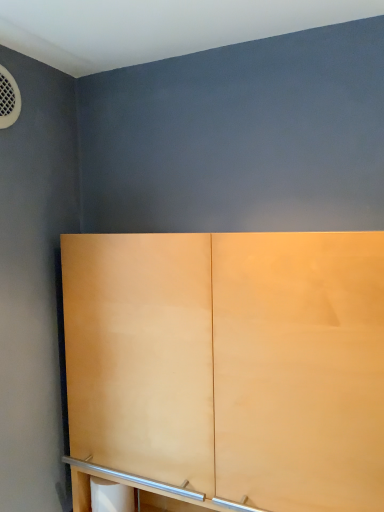
Question: In terms of height, does matte wood cupboard at center look taller or shorter compared to white matte toilet paper at lower center?

Choices:
 (A) tall
 (B) short

Answer: (A)

Question: Considering their positions, is matte wood cupboard at center located in front of or behind white matte toilet paper at lower center?

Choices:
 (A) front
 (B) behind

Answer: (A)

Question: From the image's perspective, is matte wood cupboard at center above or below white matte toilet paper at lower center?

Choices:
 (A) above
 (B) below

Answer: (A)

Question: From a real-world perspective, is white matte toilet paper at lower center above or below matte wood cupboard at center?

Choices:
 (A) below
 (B) above

Answer: (A)

Question: Considering the positions of white matte toilet paper at lower center and matte wood cupboard at center in the image, is white matte toilet paper at lower center taller or shorter than matte wood cupboard at center?

Choices:
 (A) tall
 (B) short

Answer: (B)

Question: In the image, is white matte toilet paper at lower center on the left side or the right side of matte wood cupboard at center?

Choices:
 (A) right
 (B) left

Answer: (B)

Question: From the image's perspective, is white matte toilet paper at lower center located above or below matte wood cupboard at center?

Choices:
 (A) below
 (B) above

Answer: (A)